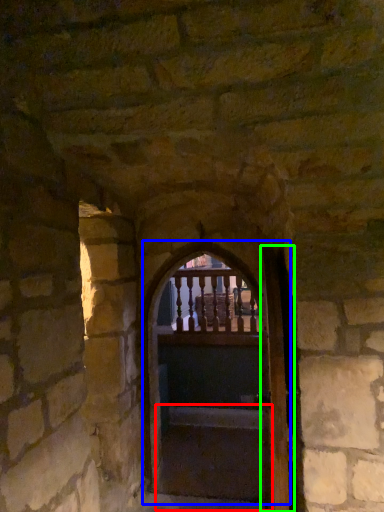
Question: Based on their relative distances, which object is nearer to stairs (highlighted by a red box)? Choose from door (highlighted by a blue box) and door (highlighted by a green box).

Choices:
 (A) door
 (B) door

Answer: (A)